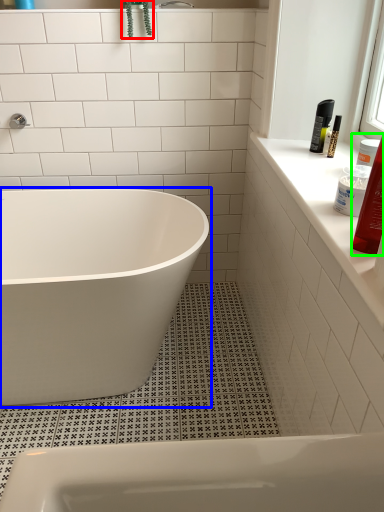
Question: Estimate the real-world distances between objects in this image. Which object is farther from plant (highlighted by a red box), bathtub (highlighted by a blue box) or toiletry (highlighted by a green box)?

Choices:
 (A) bathtub
 (B) toiletry

Answer: (B)